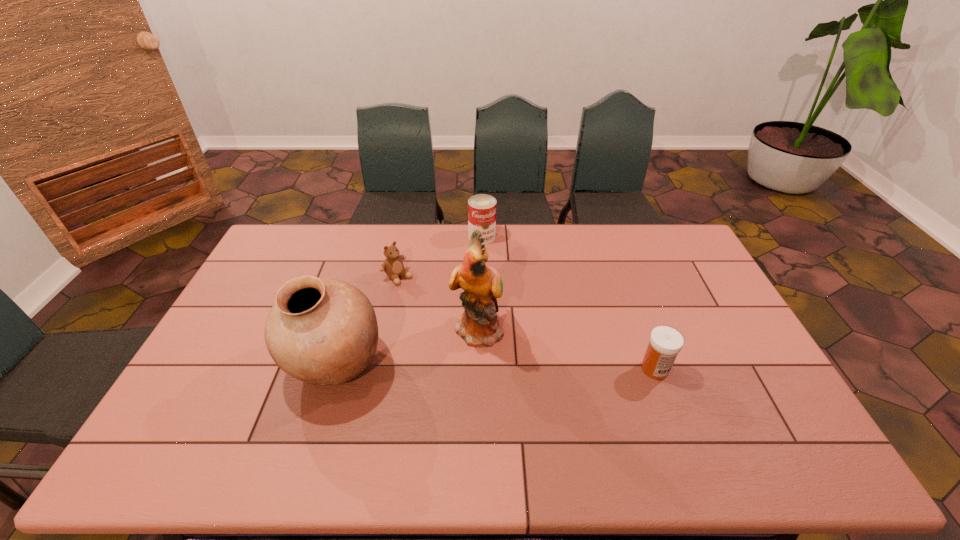
This screenshot has width=960, height=540. I want to click on free spot between the tallest object and the rightmost object, so click(566, 348).

The image size is (960, 540). I want to click on object identified as the fourth closest to the pottery, so click(665, 343).

Image resolution: width=960 pixels, height=540 pixels. I want to click on object that stands as the second closest to the parrot, so click(323, 332).

Where is `free space in the image that satisfies the following two spatial constraints: 1. on the front side of the parrot; 2. on the right side of the rightmost object`? free space in the image that satisfies the following two spatial constraints: 1. on the front side of the parrot; 2. on the right side of the rightmost object is located at coordinates (478, 369).

I want to click on free region that satisfies the following two spatial constraints: 1. on the back side of the teddy bear; 2. on the left side of the pottery, so click(362, 276).

This screenshot has width=960, height=540. Identify the location of vacant space that satisfies the following two spatial constraints: 1. on the front side of the rightmost object; 2. on the right side of the second tallest object. (333, 369).

Image resolution: width=960 pixels, height=540 pixels. Find the location of `vacant space that satisfies the following two spatial constraints: 1. on the back side of the second farthest object; 2. on the right side of the can`. vacant space that satisfies the following two spatial constraints: 1. on the back side of the second farthest object; 2. on the right side of the can is located at coordinates (406, 237).